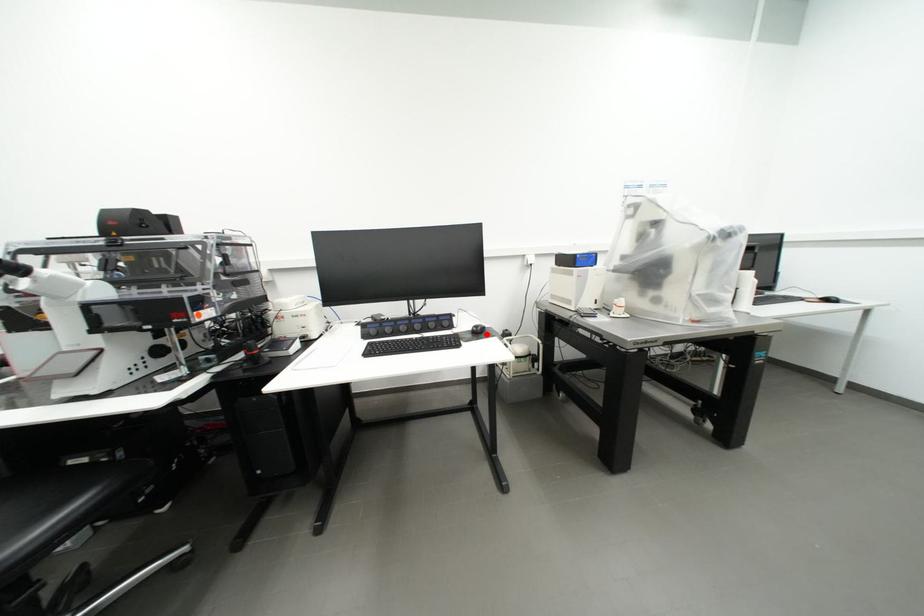
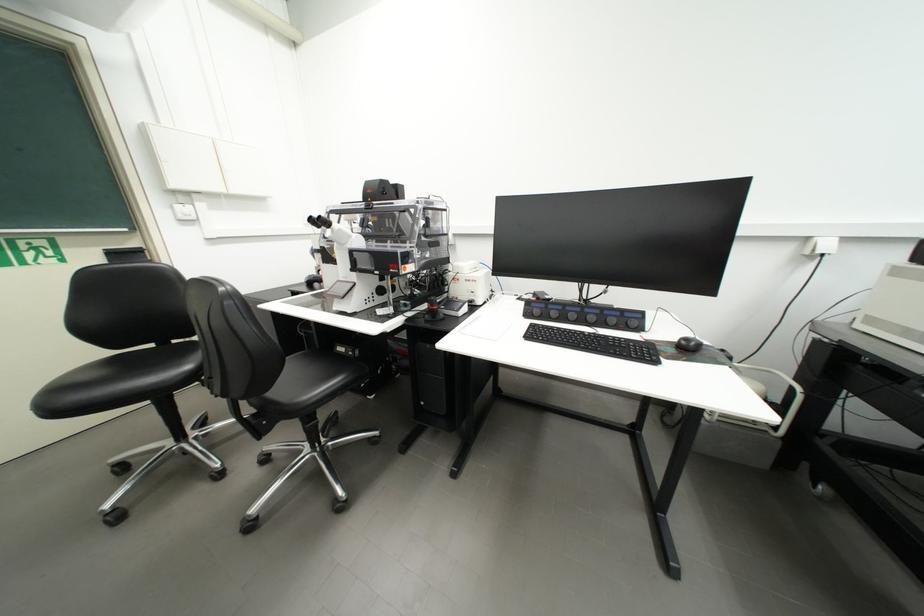
Locate, in the second image, the point that corresponds to the highlighted location in the first image.

(697, 351)